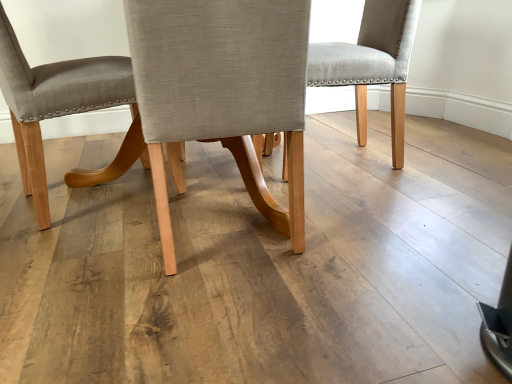
The height and width of the screenshot is (384, 512). I want to click on free space in front of light gray fabric chair at center, which is the third chair in left-to-right order, so click(403, 211).